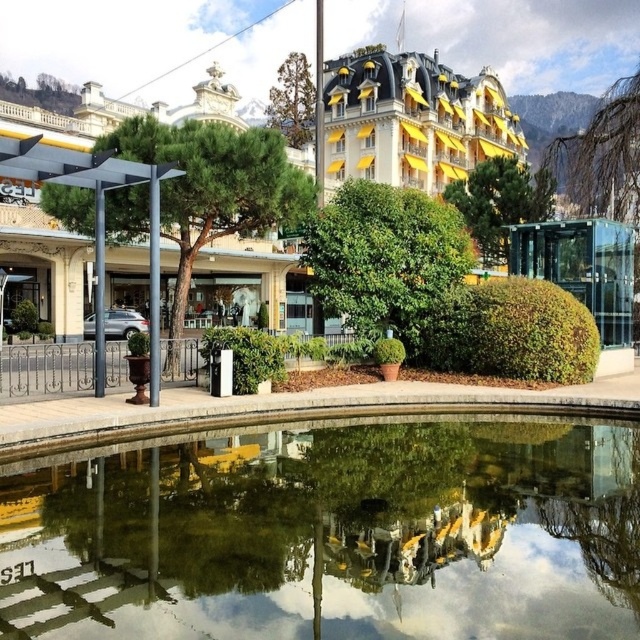
Question: Which object is the closest to the bare branches at upper right?

Choices:
 (A) green leafy tree at left
 (B) brown textured tree at upper center

Answer: (A)

Question: Does transparent glass pool at center appear over green leafy bush at center?

Choices:
 (A) yes
 (B) no

Answer: (B)

Question: Which point is farther to the camera?

Choices:
 (A) (538, 216)
 (B) (372, 186)
 (C) (289, 134)

Answer: (C)

Question: Among these objects, which one is nearest to the camera?

Choices:
 (A) transparent glass pool at center
 (B) yellow awning building at upper center
 (C) green leafy tree at left

Answer: (A)

Question: Is yellow awning building at upper center to the left of bare branches at upper right from the viewer's perspective?

Choices:
 (A) no
 (B) yes

Answer: (B)

Question: Can you confirm if yellow awning building at upper center is smaller than green leafy bush at center?

Choices:
 (A) yes
 (B) no

Answer: (B)